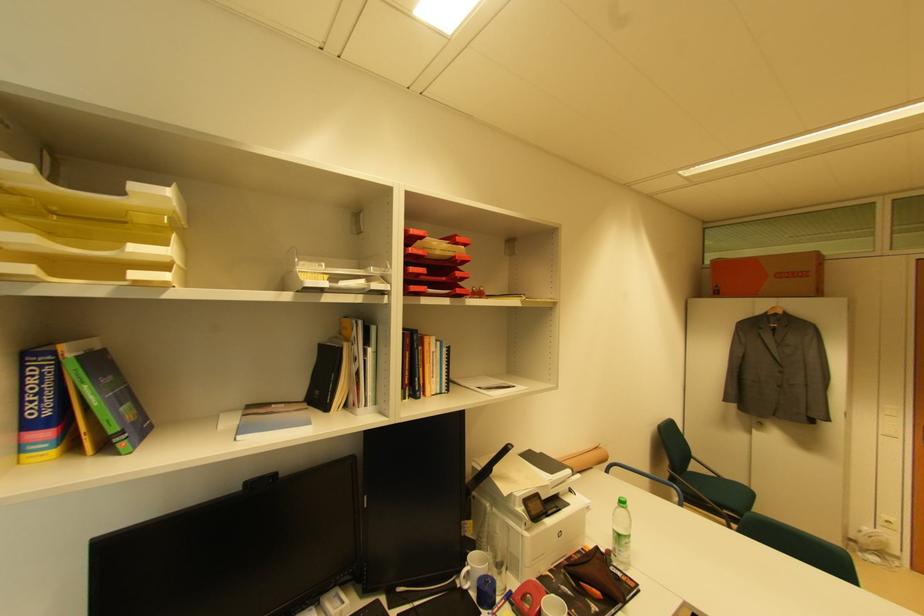
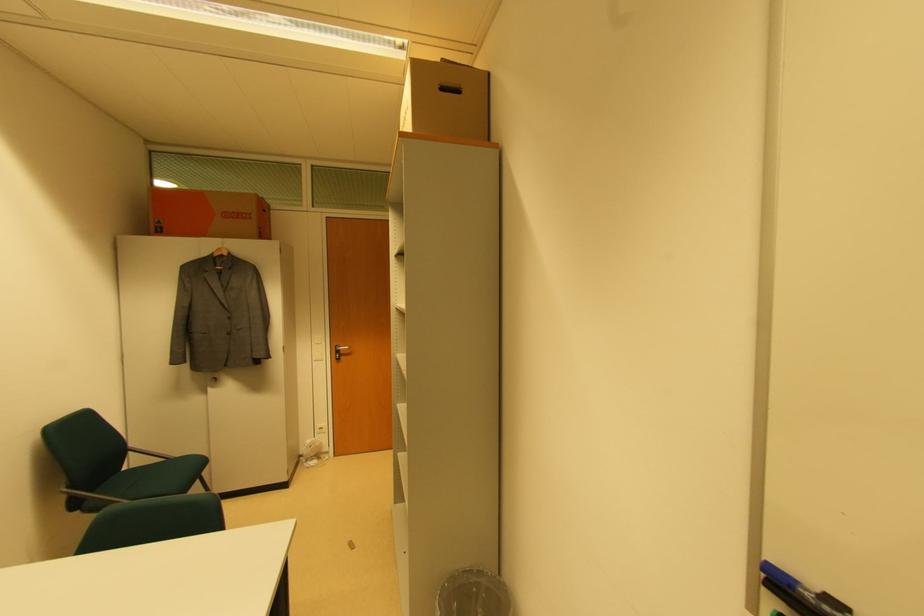
In the second image, find the point that corresponds to point (720, 293) in the first image.

(163, 230)